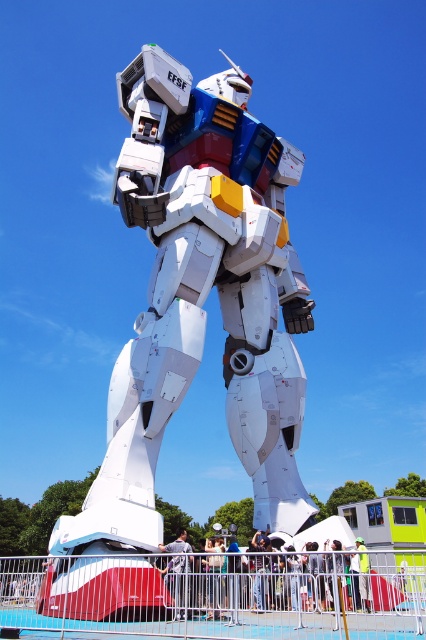
Who is higher up, white matte robot at center or light gray fabric shirt at center?

white matte robot at center

Between white matte robot at center and light gray fabric shirt at center, which one has less height?

white matte robot at center is shorter.

Does point (230, 561) lie in front of point (176, 545)?

Yes, it is in front of point (176, 545).

Locate an element on the screen. white matte robot at center is located at coordinates 264,577.

Can you confirm if white plastic robot at center is taller than light gray fabric shirt at center?

Yes.

Is white plastic robot at center thinner than light gray fabric shirt at center?

Incorrect, white plastic robot at center's width is not less than light gray fabric shirt at center's.

Identify the location of white plastic robot at center. The image size is (426, 640). (201, 300).

Can you confirm if white plastic robot at center is positioned to the right of white matte robot at center?

In fact, white plastic robot at center is to the left of white matte robot at center.

Can you confirm if white plastic robot at center is positioned above white matte robot at center?

Yes, white plastic robot at center is above white matte robot at center.

Is point (123, 449) less distant than point (354, 570)?

That is True.

Find the location of a particular element. white plastic robot at center is located at coordinates [x=201, y=300].